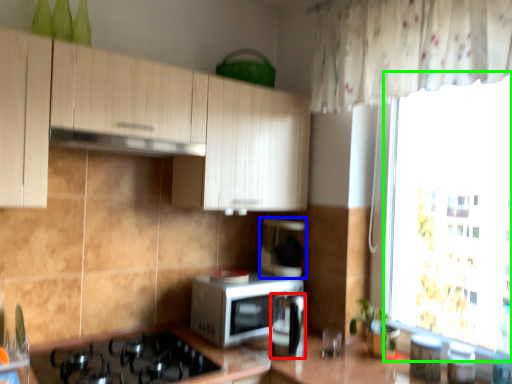
Question: Based on their relative distances, which object is nearer to appliance (highlighted by a red box)? Choose from coffee machine (highlighted by a blue box) and window screen (highlighted by a green box).

Choices:
 (A) coffee machine
 (B) window screen

Answer: (A)